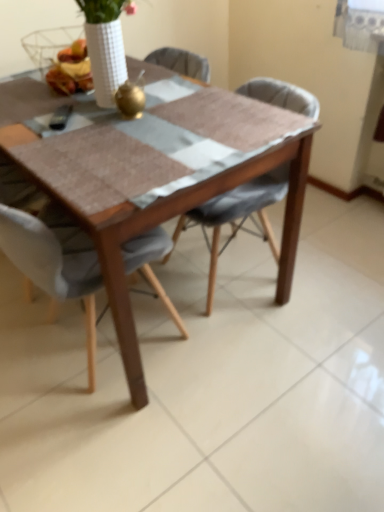
Locate an element on the screen. This screenshot has height=512, width=384. empty space that is ontop of wooden table at center (from a real-world perspective) is located at coordinates (117, 118).